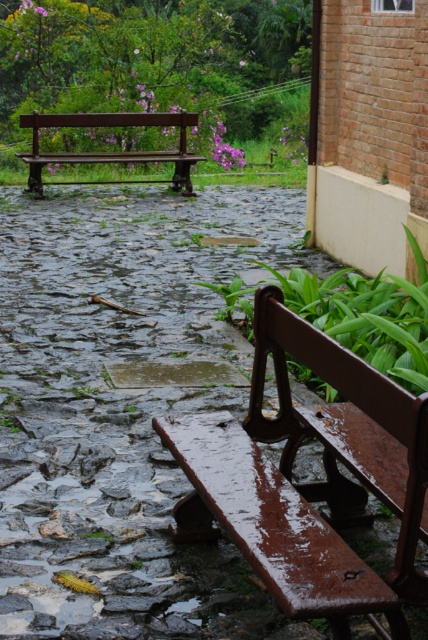
You are standing at the entrance of the brick building and want to sit on one of the benches. Which bench, the rusty wood bench at lower center or the rustic wood bench at upper left, is closer to you?

The rusty wood bench at lower center is closer to you than the rustic wood bench at upper left.